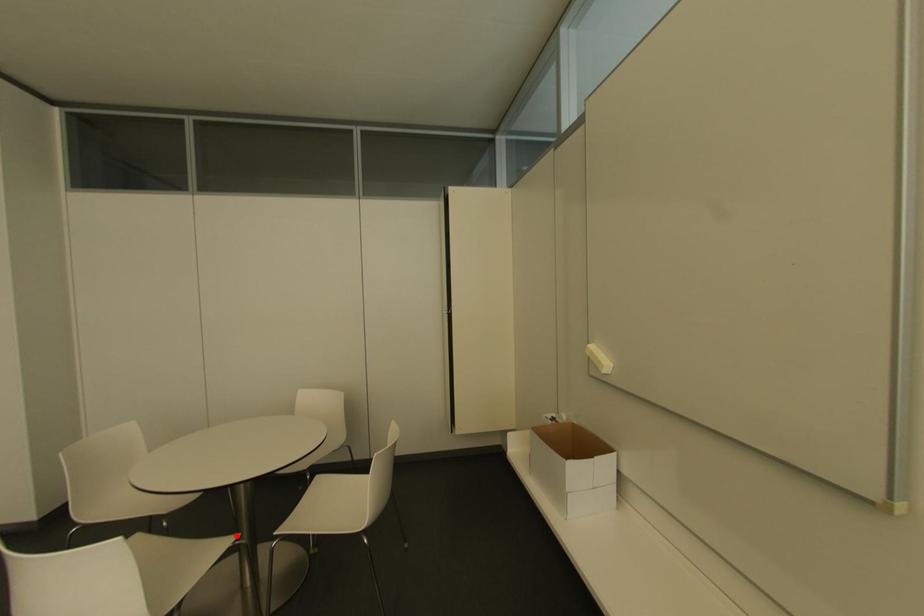
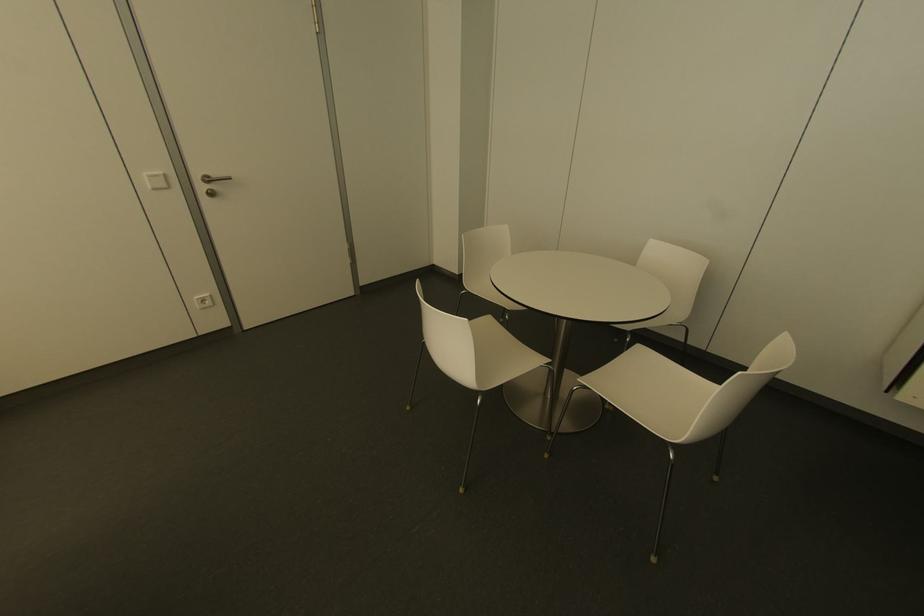
Locate, in the second image, the point that corresponds to the highlighted location in the first image.

(546, 361)